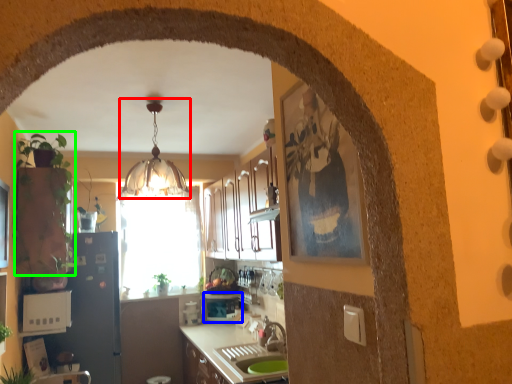
Question: Which object is the closest to the light fixture (highlighted by a red box)? Choose among these: appliance (highlighted by a blue box) or plant (highlighted by a green box).

Choices:
 (A) appliance
 (B) plant

Answer: (B)